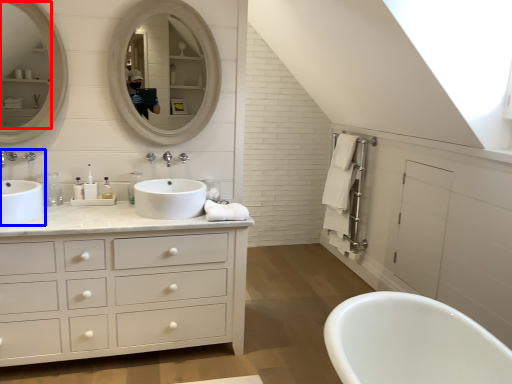
Question: Which point is further to the camera, mirror (highlighted by a red box) or sink (highlighted by a blue box)?

Choices:
 (A) mirror
 (B) sink

Answer: (A)